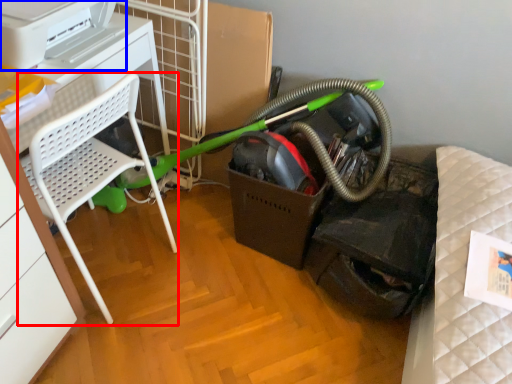
Question: Among these objects, which one is nearest to the camera, furniture (highlighted by a red box) or printer (highlighted by a blue box)?

Choices:
 (A) furniture
 (B) printer

Answer: (A)